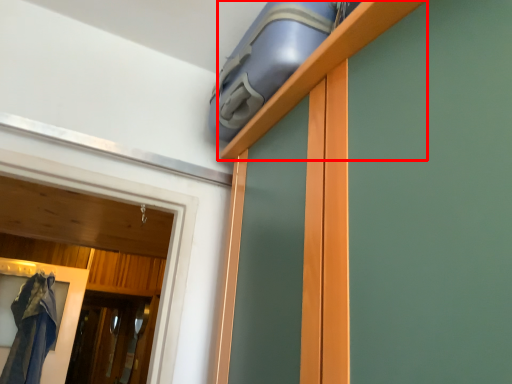
Question: Observing the image, what is the correct spatial positioning of shelf (annotated by the red box) in reference to screen door?

Choices:
 (A) left
 (B) right

Answer: (B)